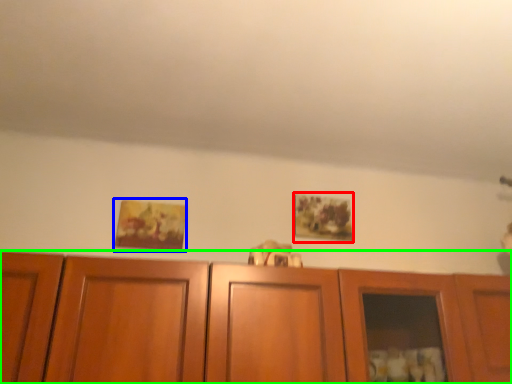
Question: Which object is the closest to the picture frame (highlighted by a red box)? Choose among these: picture frame (highlighted by a blue box) or cabinetry (highlighted by a green box).

Choices:
 (A) picture frame
 (B) cabinetry

Answer: (B)